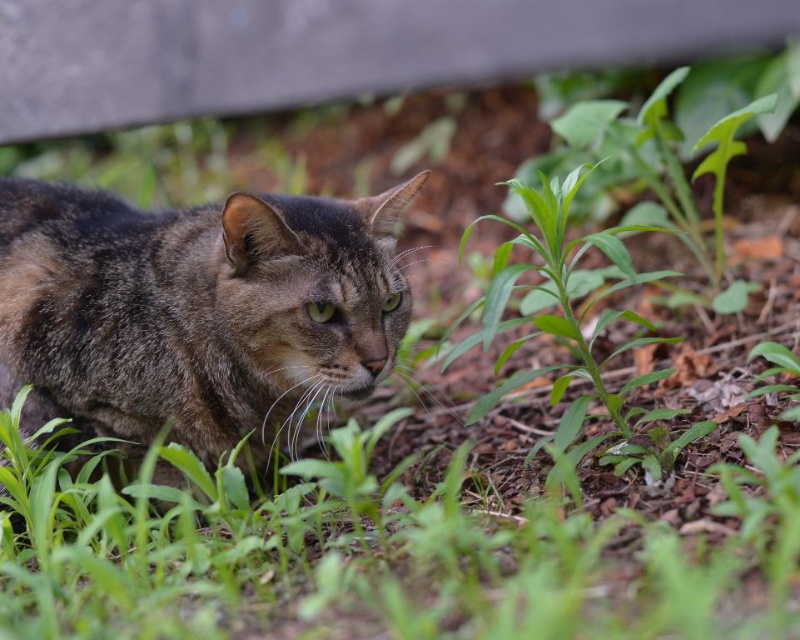
You are a photographer trying to capture a shot of the tabby fur cat at center and the green leafy plant at center. From which side of the cat should you position yourself to ensure both subjects are fully visible in the frame?

You should position yourself to the right of the tabby fur cat at center because it is to the left of the green leafy plant at center, so placing yourself to the right of the cat would allow both subjects to be in the frame without obstruction.

You are a photographer trying to capture the tabby fur cat at center. Based on the scene description, where should you position your camera to ensure the cat is centered in your shot?

The tabby fur cat at center is located at the 2D coordinates point (x=196, y=310), so positioning the camera to aim directly at this point will center the cat in the photograph.